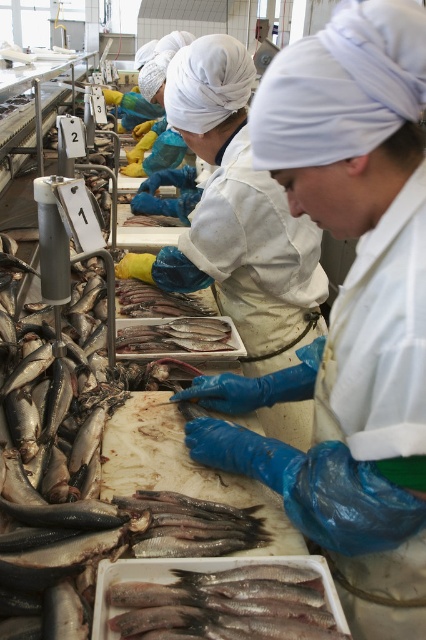
Is blue rubber gloves at center wider than silvery metallic fish at center?

Yes, blue rubber gloves at center is wider than silvery metallic fish at center.

Between blue rubber gloves at center and silvery metallic fish at center, which one is positioned lower?

silvery metallic fish at center

Does point (282, 353) come farther from viewer compared to point (296, 614)?

Yes, point (282, 353) is farther from viewer.

The image size is (426, 640). Find the location of `blue rubber gloves at center`. blue rubber gloves at center is located at coordinates (236, 216).

Where is `silvery metallic fish at center`? The image size is (426, 640). silvery metallic fish at center is located at coordinates (227, 604).

Who is positioned more to the left, silvery metallic fish at center or shiny silver fish at center?

shiny silver fish at center is more to the left.

Does point (187, 577) come behind point (134, 333)?

No.

Where is `silvery metallic fish at center`? The image size is (426, 640). silvery metallic fish at center is located at coordinates (227, 604).

Who is positioned more to the right, blue rubber gloves at center or shiny silver fish at center?

From the viewer's perspective, blue rubber gloves at center appears more on the right side.

Does blue rubber gloves at center lie behind shiny silver fish at center?

No, blue rubber gloves at center is closer to the viewer.

Identify the location of blue rubber gloves at center. (236, 216).